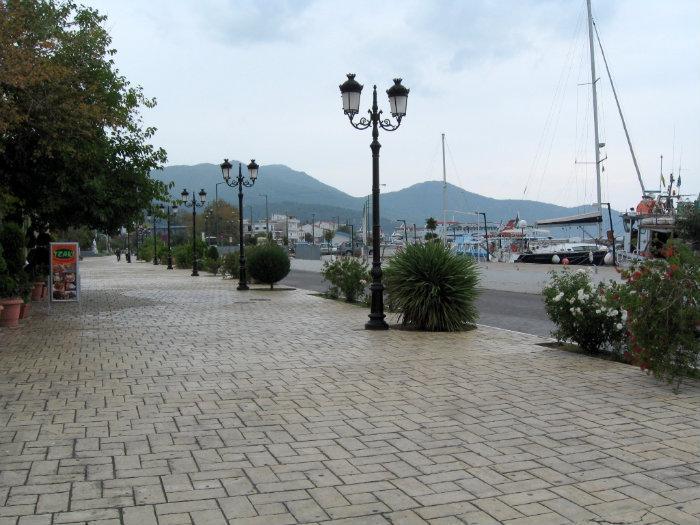
This screenshot has width=700, height=525. Find the location of `plant pots`. plant pots is located at coordinates (13, 313), (40, 288).